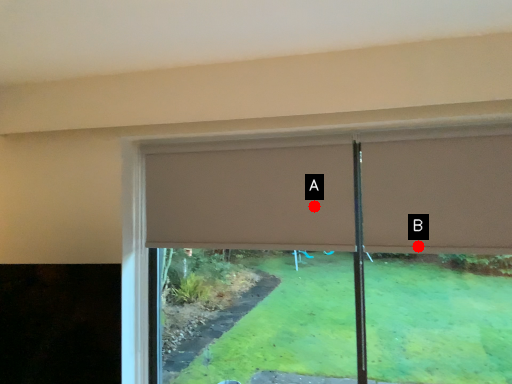
Question: Two points are circled on the image, labeled by A and B beside each circle. Which point is farther to the camera?

Choices:
 (A) A is further
 (B) B is further

Answer: (A)